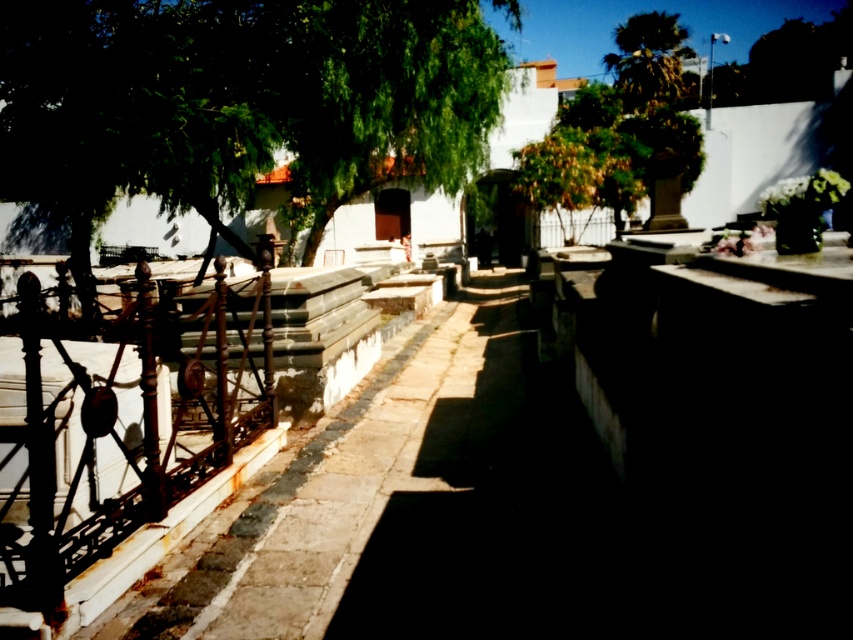
Question: Estimate the real-world distances between objects in this image. Which object is farther from the rusty metal rail at left?

Choices:
 (A) green leafy tree at upper right
 (B) green leafy tree at upper left

Answer: (A)

Question: Does rusty metal rail at left appear on the left side of green leafy tree at upper right?

Choices:
 (A) yes
 (B) no

Answer: (A)

Question: Which of the following is the closest to the observer?

Choices:
 (A) green leafy tree at upper left
 (B) green leafy tree at upper right

Answer: (A)

Question: Can you confirm if rusty metal rail at left is positioned to the left of green leafy tree at upper right?

Choices:
 (A) yes
 (B) no

Answer: (A)

Question: Among these points, which one is farthest from the camera?

Choices:
 (A) (154, 394)
 (B) (633, 93)
 (C) (317, 240)

Answer: (B)

Question: Is green leafy tree at upper left to the left of green leafy tree at upper right from the viewer's perspective?

Choices:
 (A) yes
 (B) no

Answer: (A)